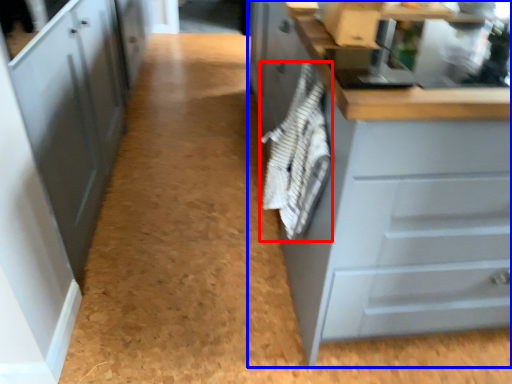
Question: Which object appears farthest to the camera in this image, material (highlighted by a red box) or cabinetry (highlighted by a blue box)?

Choices:
 (A) material
 (B) cabinetry

Answer: (A)